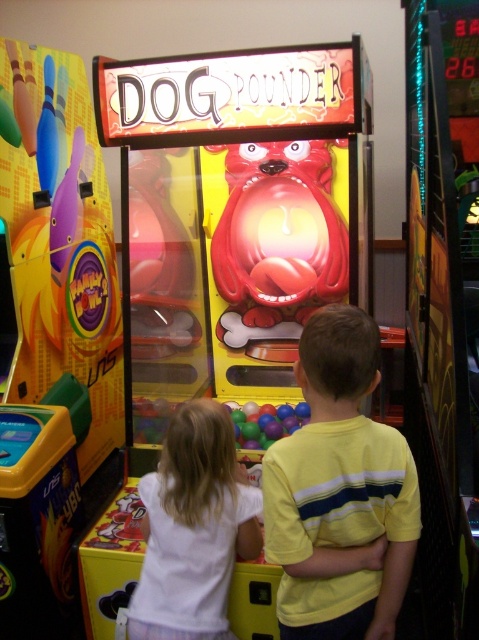
Question: Observing the image, what is the correct spatial positioning of yellow striped shirt at center in reference to multicolored plastic balls at center?

Choices:
 (A) below
 (B) above

Answer: (B)

Question: Based on their relative distances, which object is farther from the white cotton shirt at center?

Choices:
 (A) yellow striped shirt at center
 (B) multicolored plastic balls at center

Answer: (B)

Question: Observing the image, what is the correct spatial positioning of white cotton shirt at center in reference to multicolored plastic balls at center?

Choices:
 (A) left
 (B) right

Answer: (A)

Question: Among these objects, which one is farthest from the camera?

Choices:
 (A) white cotton shirt at center
 (B) yellow striped shirt at center
 (C) multicolored plastic balls at center

Answer: (C)

Question: Is yellow striped shirt at center positioned before multicolored plastic balls at center?

Choices:
 (A) no
 (B) yes

Answer: (B)

Question: Which point appears closest to the camera in this image?

Choices:
 (A) (152, 480)
 (B) (285, 420)
 (C) (417, 483)

Answer: (C)